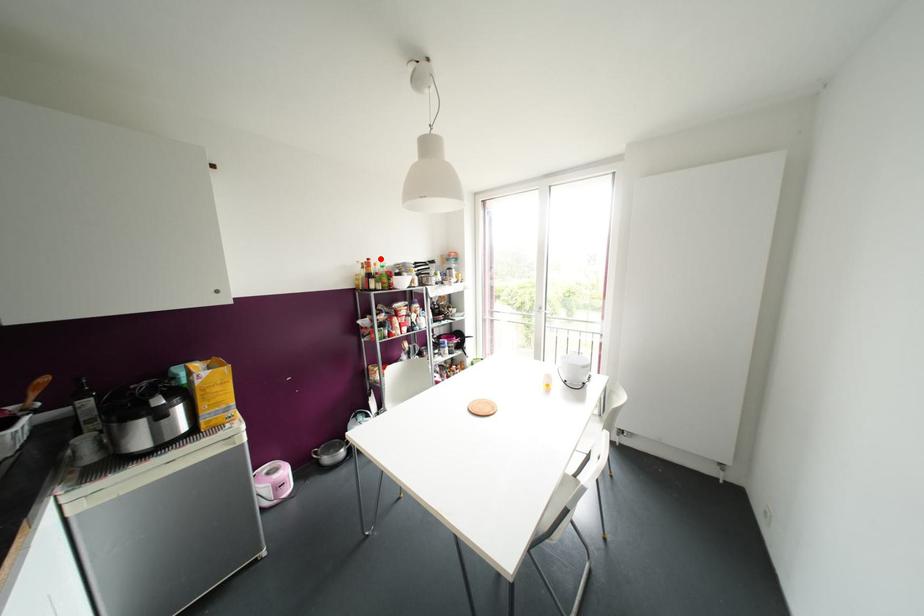
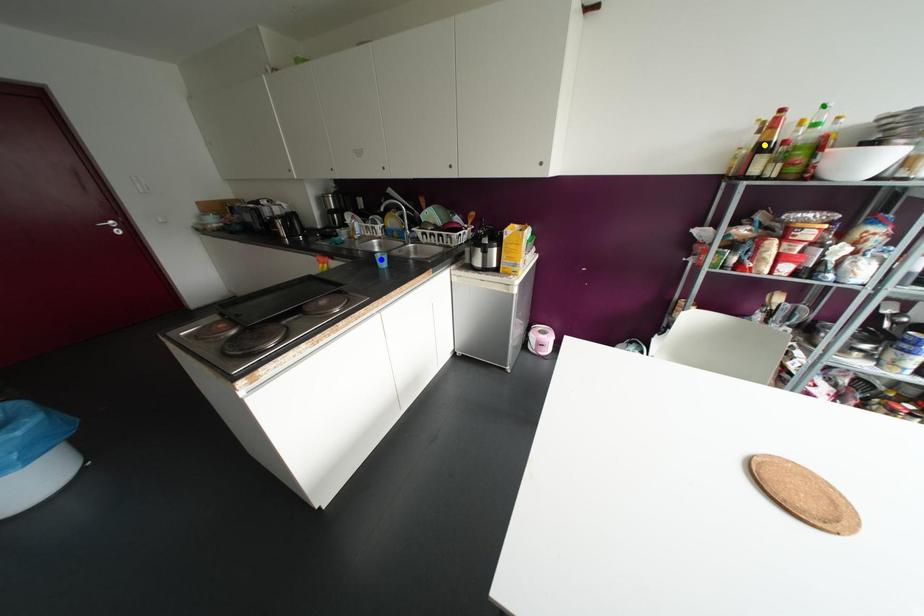
Question: I am providing you with two images of the same scene from different viewpoints. A red point is marked on the first image. You are given multiple points on the second image. Which mark in image 2 goes with the point in image 1?

Choices:
 (A) blue point
 (B) green point
 (C) yellow point

Answer: (B)